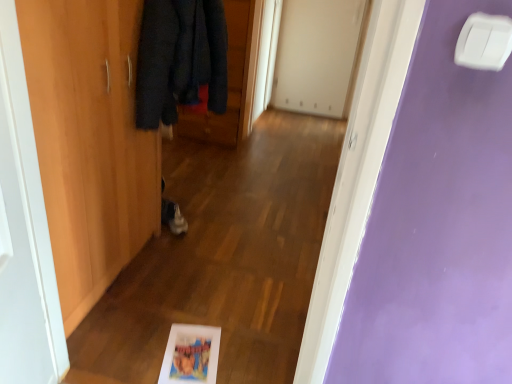
You are a GUI agent. You are given a task and a screenshot of the screen. Output one action in this format:
    pyautogui.click(x=<x>, y=<y>)
    Task: Click on the vacant space underneath dark blue woolen coat at upper left (from a real-world perspective)
    The image size is (512, 384).
    Given the screenshot: What is the action you would take?
    pyautogui.click(x=181, y=244)